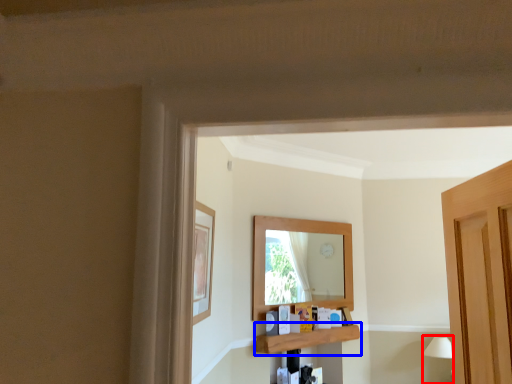
Question: Which object appears closest to the camera in this image, lamp (highlighted by a red box) or shelf (highlighted by a blue box)?

Choices:
 (A) lamp
 (B) shelf

Answer: (B)